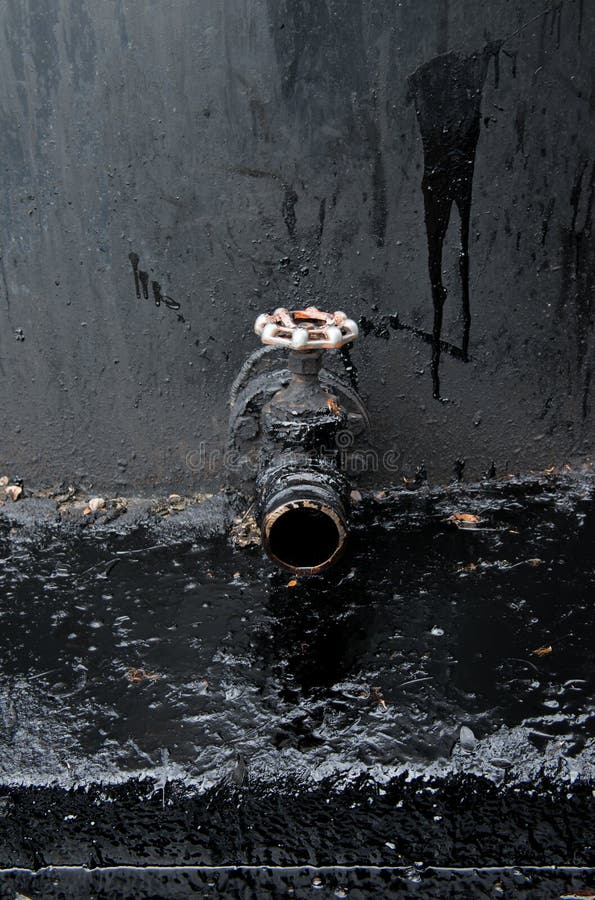
Identify the location of line in tub. (239, 866).